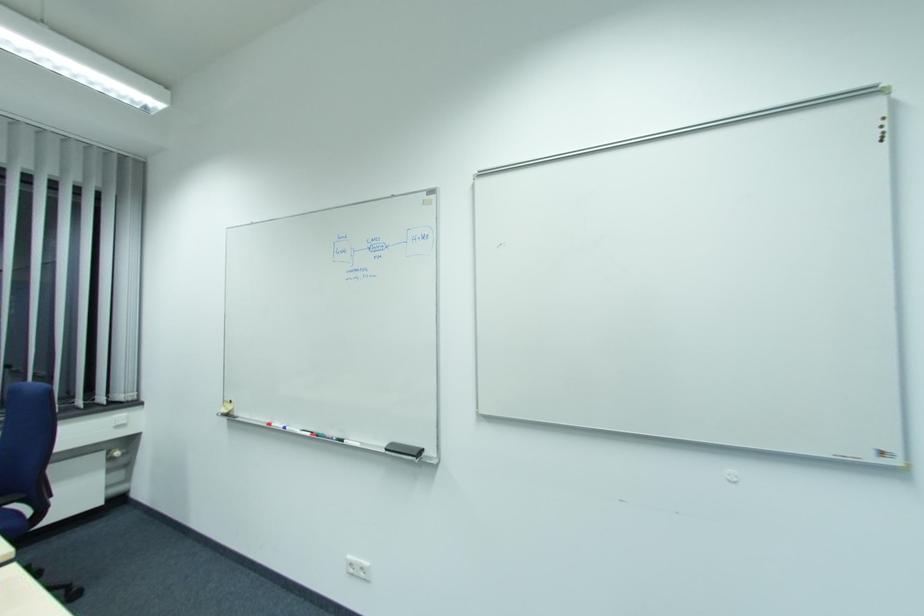
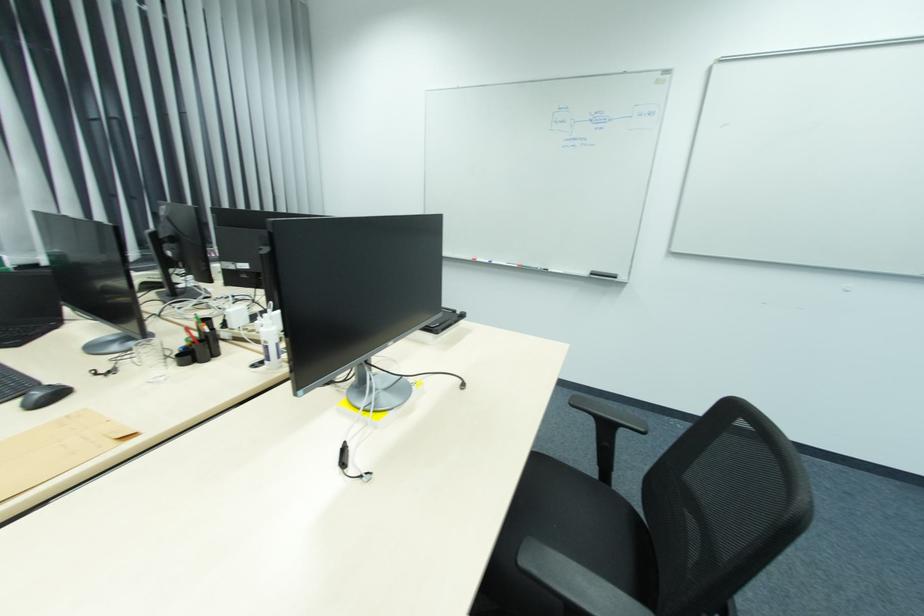
The images are taken continuously from a first-person perspective. In which direction are you moving?

The cameraman moved toward left, backward.